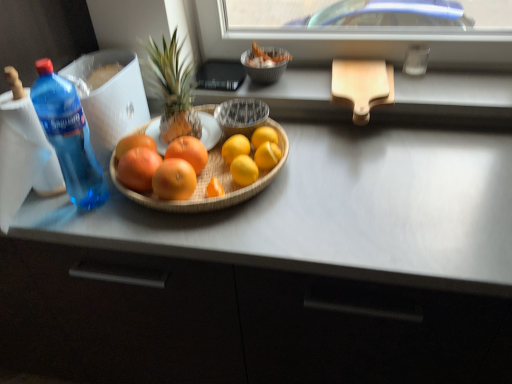
Question: Can you confirm if bamboo tray at center is positioned to the right of metallic silver bowl at upper center?

Choices:
 (A) yes
 (B) no

Answer: (B)

Question: Could you tell me if bamboo tray at center is turned towards metallic silver bowl at upper center?

Choices:
 (A) no
 (B) yes

Answer: (A)

Question: Is bamboo tray at center with metallic silver bowl at upper center?

Choices:
 (A) no
 (B) yes

Answer: (A)

Question: Would you say bamboo tray at center contains metallic silver bowl at upper center?

Choices:
 (A) no
 (B) yes

Answer: (A)

Question: Is the depth of bamboo tray at center greater than that of metallic silver bowl at upper center?

Choices:
 (A) no
 (B) yes

Answer: (A)

Question: Considering their positions, is orange matte grapefruit at center, which ranks as the fourth grapefruit in right-to-left order, located in front of or behind metallic silver bowl at upper center?

Choices:
 (A) front
 (B) behind

Answer: (A)

Question: Is point (148, 173) positioned closer to the camera than point (272, 72)?

Choices:
 (A) farther
 (B) closer

Answer: (B)

Question: From the image's perspective, is orange matte grapefruit at center, which ranks as the fourth grapefruit in right-to-left order, located above or below metallic silver bowl at upper center?

Choices:
 (A) below
 (B) above

Answer: (A)

Question: Based on their sizes in the image, would you say orange matte grapefruit at center, marked as the 2th grapefruit in a left-to-right arrangement, is bigger or smaller than metallic silver bowl at upper center?

Choices:
 (A) big
 (B) small

Answer: (B)

Question: In terms of height, does wooden cutting board at upper right look taller or shorter compared to yellow matte grapefruit at center, arranged as the first grapefruit when viewed from the right?

Choices:
 (A) short
 (B) tall

Answer: (A)

Question: Looking at their shapes, would you say wooden cutting board at upper right is wider or thinner than yellow matte grapefruit at center, arranged as the first grapefruit when viewed from the right?

Choices:
 (A) thin
 (B) wide

Answer: (B)

Question: Does point (393, 79) appear closer or farther from the camera than point (264, 170)?

Choices:
 (A) farther
 (B) closer

Answer: (A)

Question: Do you think wooden cutting board at upper right is within yellow matte grapefruit at center, arranged as the first grapefruit when viewed from the right, or outside of it?

Choices:
 (A) outside
 (B) inside

Answer: (A)

Question: Looking at the image, does blue translucent bottle at left seem bigger or smaller compared to green textured pineapple at center?

Choices:
 (A) big
 (B) small

Answer: (A)

Question: Is blue translucent bottle at left in front of or behind green textured pineapple at center in the image?

Choices:
 (A) behind
 (B) front

Answer: (B)